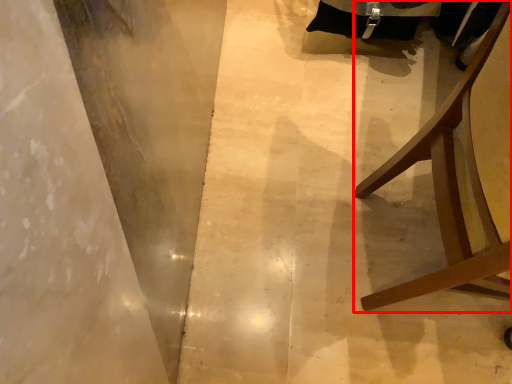
Question: From the image's perspective, where is furniture (annotated by the red box) located in relation to concrete in the image?

Choices:
 (A) above
 (B) below

Answer: (B)